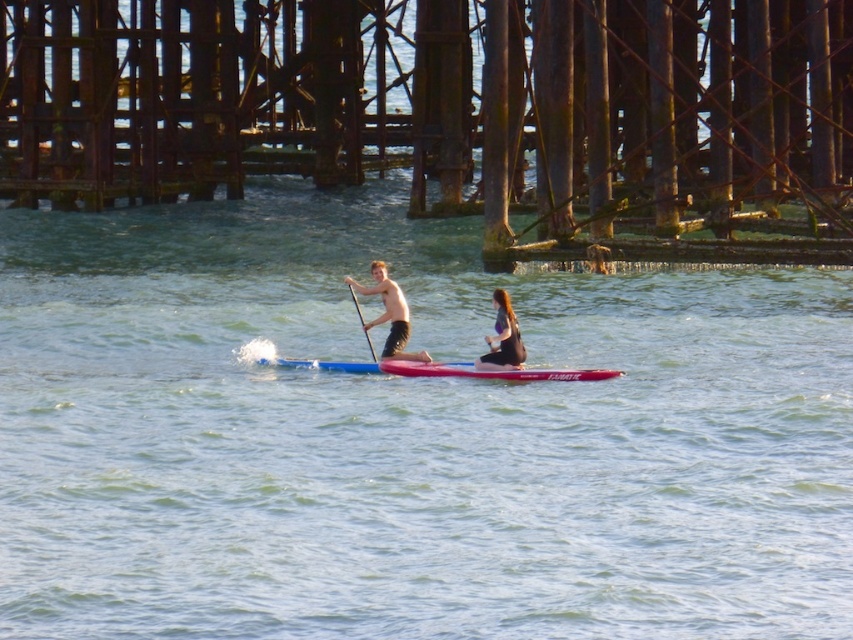
You are a photographer positioned on the pier trying to capture a closeup shot of both the red glossy paddleboard at center and the matte black wetsuit at center. Given that your camera has a maximum focus range of 1.2 meters, will you be able to capture both subjects clearly in the same frame?

The red glossy paddleboard at center is 1.18 meters away from the matte black wetsuit at center. Since the distance between them is within the camera maximum focus range of 1.2 meters, you can capture both subjects clearly in the same frame.

You are standing on the pier and want to jump into the clear blue water at center. The safety guidelines state that you must be at least 30 meters away from any other swimmers before jumping. Are you within the safe distance according to the guidelines?

The distance between you and the clear blue water at center is 31.47 meters, which exceeds the minimum required 30 meters. Therefore, you are within the safe distance to jump in.